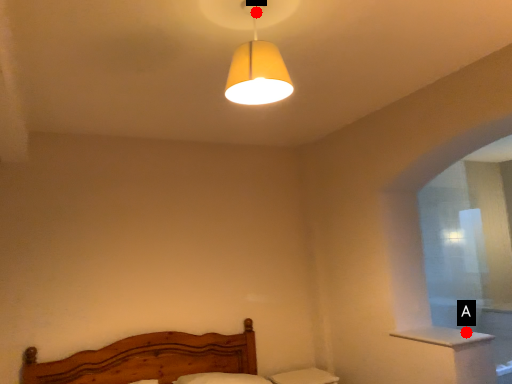
Question: Two points are circled on the image, labeled by A and B beside each circle. Which point is farther to the camera?

Choices:
 (A) A is further
 (B) B is further

Answer: (A)